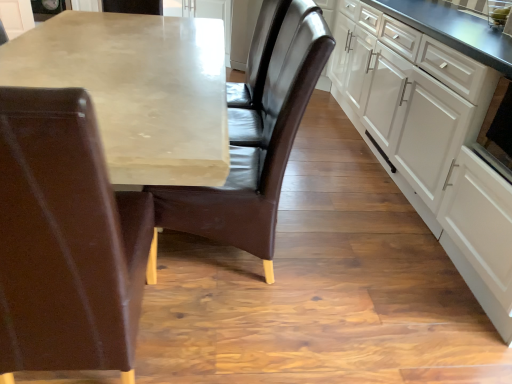
Question: Is matte concrete table at center inside or outside of leather chair at left, which appears as the 2th chair when viewed from the right?

Choices:
 (A) inside
 (B) outside

Answer: (B)

Question: From the image's perspective, relative to leather chair at left, which is the first chair from left to right, is matte concrete table at center above or below?

Choices:
 (A) above
 (B) below

Answer: (A)

Question: Estimate the real-world distances between objects in this image. Which object is closer to the matte concrete table at center?

Choices:
 (A) leather chair at left, which is the first chair from left to right
 (B) brown leather chair at center, which is counted as the 1th chair, starting from the right
 (C) black glossy oven at right
 (D) white matte cabinet at right

Answer: (B)

Question: Estimate the real-world distances between objects in this image. Which object is closer to the black glossy oven at right?

Choices:
 (A) white matte cabinet at right
 (B) brown leather chair at center, which is counted as the 1th chair, starting from the right
 (C) matte concrete table at center
 (D) leather chair at left, which appears as the 2th chair when viewed from the right

Answer: (A)